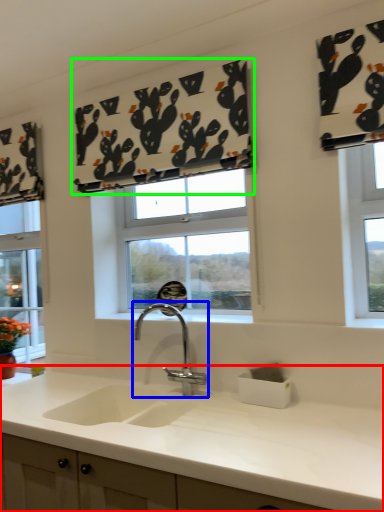
Question: Which object is the farthest from countertop (highlighted by a red box)? Choose among these: tap (highlighted by a blue box) or curtain (highlighted by a green box).

Choices:
 (A) tap
 (B) curtain

Answer: (B)